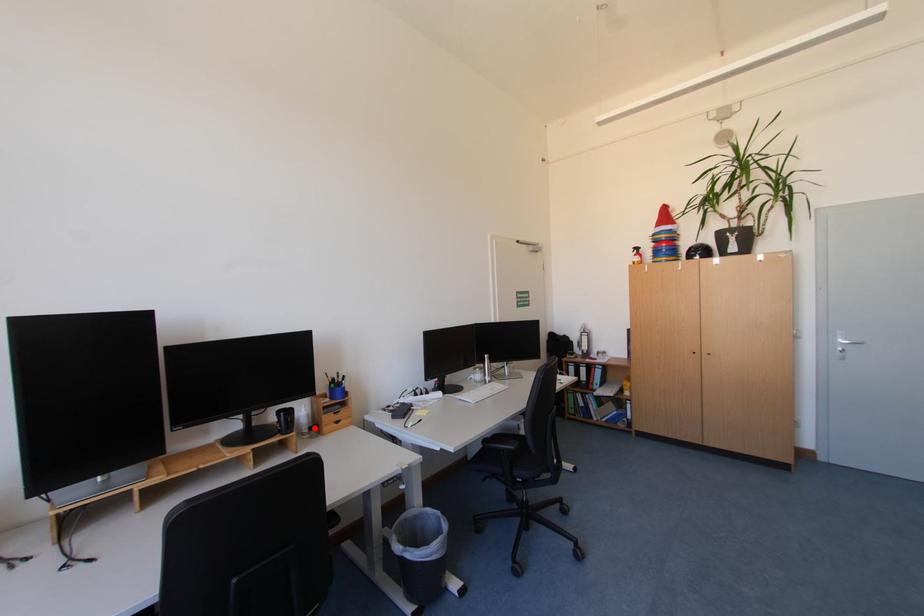
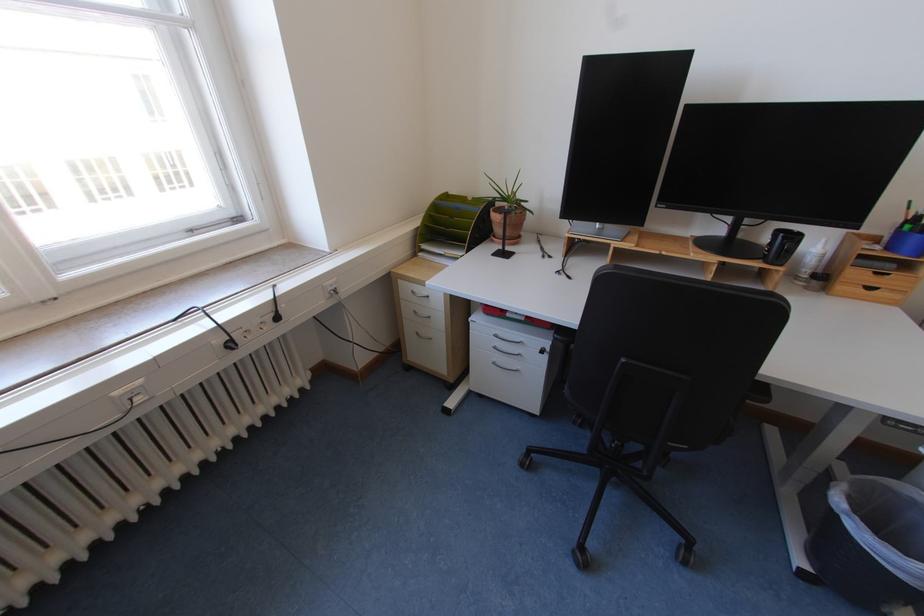
Find the pixel in the second image that matches the highlighted location in the first image.

(818, 273)